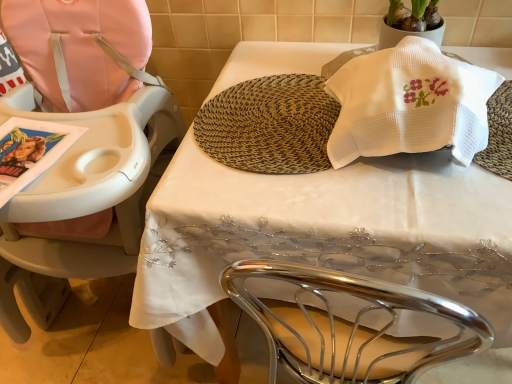
Identify the location of empty space that is ontop of white embroidered tablecloth at center (from a real-world perspective). Image resolution: width=512 pixels, height=384 pixels. (345, 159).